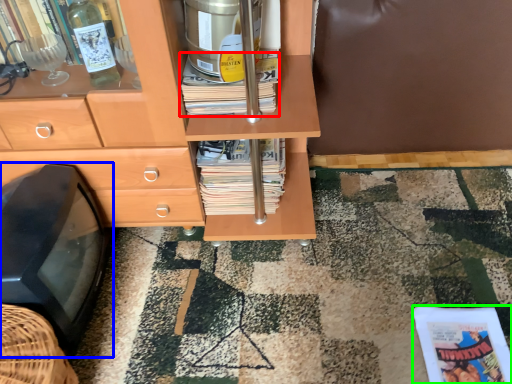
Question: Which object is positioned closest to book (highlighted by a red box)? Select from flat (highlighted by a blue box) and paperback book (highlighted by a green box).

Choices:
 (A) flat
 (B) paperback book

Answer: (A)